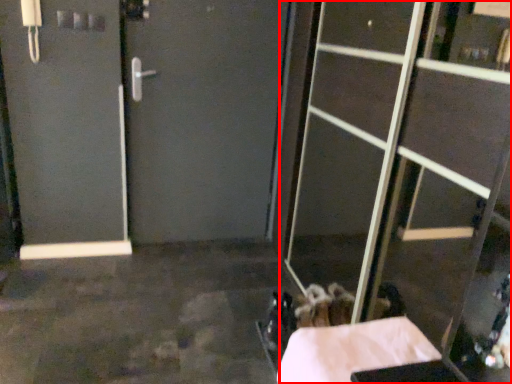
Question: From the image's perspective, what is the correct spatial positioning of glass door (annotated by the red box) in reference to concrete?

Choices:
 (A) below
 (B) above

Answer: (B)